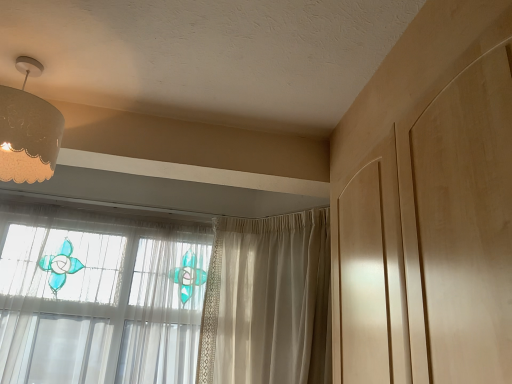
Question: Could you tell me if matte white lampshade at upper left is turned towards sheer beige curtain at center?

Choices:
 (A) no
 (B) yes

Answer: (A)

Question: Does matte white lampshade at upper left have a lesser height compared to sheer beige curtain at center?

Choices:
 (A) no
 (B) yes

Answer: (B)

Question: From the image's perspective, is matte white lampshade at upper left below sheer beige curtain at center?

Choices:
 (A) no
 (B) yes

Answer: (A)

Question: Can you confirm if matte white lampshade at upper left is wider than sheer beige curtain at center?

Choices:
 (A) yes
 (B) no

Answer: (B)

Question: Is matte white lampshade at upper left placed right next to sheer beige curtain at center?

Choices:
 (A) yes
 (B) no

Answer: (B)

Question: Does matte white lampshade at upper left have a smaller size compared to sheer beige curtain at center?

Choices:
 (A) no
 (B) yes

Answer: (B)

Question: Can you confirm if sheer beige curtain at center is wider than matte white lampshade at upper left?

Choices:
 (A) no
 (B) yes

Answer: (B)

Question: From a real-world perspective, is sheer beige curtain at center physically below matte white lampshade at upper left?

Choices:
 (A) yes
 (B) no

Answer: (A)

Question: Is sheer beige curtain at center smaller than matte white lampshade at upper left?

Choices:
 (A) yes
 (B) no

Answer: (B)

Question: From the image's perspective, is sheer beige curtain at center located beneath matte white lampshade at upper left?

Choices:
 (A) no
 (B) yes

Answer: (B)

Question: Is the position of sheer beige curtain at center more distant than that of matte white lampshade at upper left?

Choices:
 (A) no
 (B) yes

Answer: (B)

Question: Is sheer beige curtain at center positioned far away from matte white lampshade at upper left?

Choices:
 (A) yes
 (B) no

Answer: (A)

Question: Considering the positions of sheer beige curtain at center and matte white lampshade at upper left in the image, is sheer beige curtain at center bigger or smaller than matte white lampshade at upper left?

Choices:
 (A) small
 (B) big

Answer: (B)